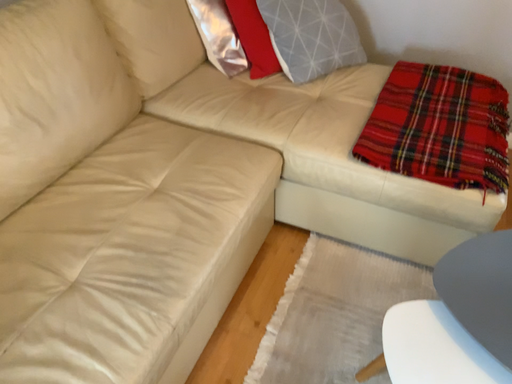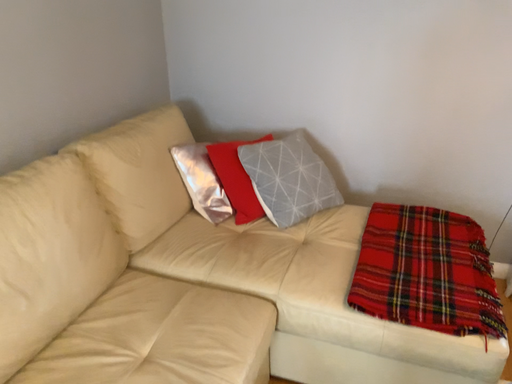
Question: How did the camera likely rotate when shooting the video?

Choices:
 (A) rotated upward
 (B) rotated downward

Answer: (A)